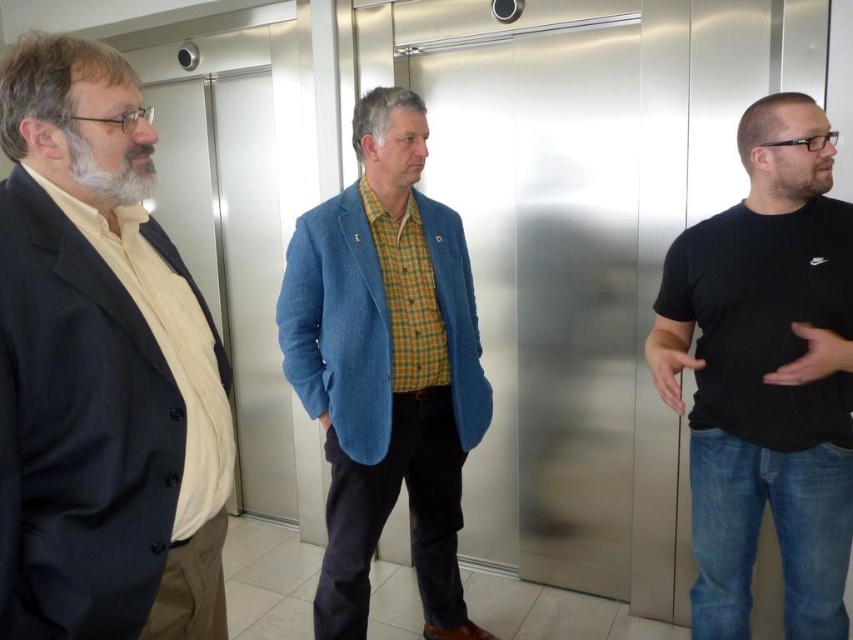
You are a delivery robot with a package that needs to be placed between the matte black suit at left and the blue corduroy blazer at center. The package requires at least 30 inches of space to fit. Can you place it there?

The distance between the matte black suit at left and the blue corduroy blazer at center is 30.56 inches, so yes, the package can be placed there as it meets the required space.

You are standing in an elevator with three men. There is a point at coordinates (128, 342). Can you reach this point without moving your feet?

The point at coordinates (128, 342) is 1.05 meters away from you, so you can reach it without moving your feet if you can extend your arm that far.